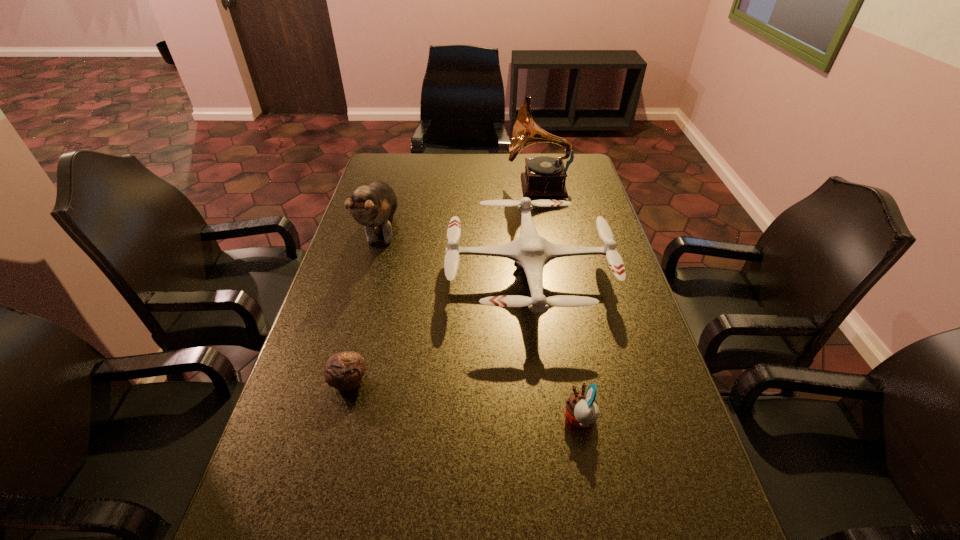
Identify the location of muffin that is at the left edge. (344, 371).

You are a GUI agent. You are given a task and a screenshot of the screen. Output one action in this format:
    pyautogui.click(x=<x>, y=<y>)
    Task: Click on the phonograph_record located in the right edge section of the desktop
    The width and height of the screenshot is (960, 540).
    Given the screenshot: What is the action you would take?
    pyautogui.click(x=544, y=176)

Find the location of `drone that is at the right edge`. drone that is at the right edge is located at coordinates (530, 252).

You are a GUI agent. You are given a task and a screenshot of the screen. Output one action in this format:
    pyautogui.click(x=<x>, y=<y>)
    Task: Click on the object at the far right corner
    
    Given the screenshot: What is the action you would take?
    pyautogui.click(x=544, y=176)

Image resolution: width=960 pixels, height=540 pixels. I want to click on vacant area at the far edge, so click(470, 166).

Image resolution: width=960 pixels, height=540 pixels. Identify the location of vacant region at the left edge. (331, 468).

Identify the location of vacant space at the right edge. This screenshot has width=960, height=540. (597, 245).

Find the location of `free space at the far left corner`. free space at the far left corner is located at coordinates (387, 160).

Locate an element on the screen. This screenshot has width=960, height=540. vacant space that is in between the right muffin and the cat is located at coordinates (481, 325).

Identify the location of free space between the tallest object and the cat. This screenshot has height=540, width=960. [461, 208].